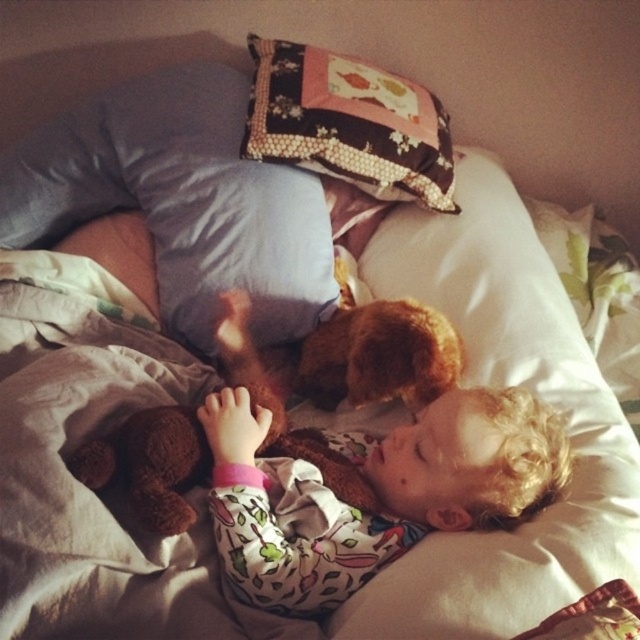
How far apart are fluffy brown teddy bear at center and patchwork fabric pillow at upper center?

The distance of fluffy brown teddy bear at center from patchwork fabric pillow at upper center is 22.27 inches.

Between point (230, 432) and point (276, 104), which one is positioned in front?

Point (230, 432) is in front.

I want to click on fluffy brown teddy bear at center, so (374, 488).

Is the position of fluffy fabric pillow at upper center less distant than that of fluffy brown teddy bear at center?

No, fluffy fabric pillow at upper center is behind fluffy brown teddy bear at center.

This screenshot has height=640, width=640. What do you see at coordinates (180, 200) in the screenshot?
I see `fluffy fabric pillow at upper center` at bounding box center [180, 200].

Where is `fluffy fabric pillow at upper center`? fluffy fabric pillow at upper center is located at coordinates (180, 200).

Is point (259, 198) closer to viewer compared to point (435, 160)?

Yes, point (259, 198) is in front of point (435, 160).

Between point (310, 243) and point (308, 104), which one is positioned in front?

Positioned in front is point (310, 243).

Where is `fluffy fabric pillow at upper center`? fluffy fabric pillow at upper center is located at coordinates (180, 200).